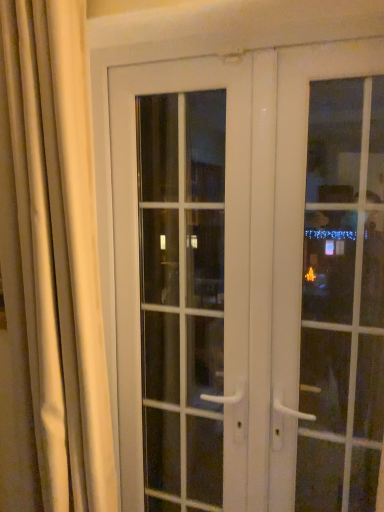
Question: In the image, is white glass door at center, acting as the first door starting from the left, positioned in front of or behind white glossy door at right, placed as the third door when sorted from left to right?

Choices:
 (A) behind
 (B) front

Answer: (A)

Question: Is white glass door at center, which is counted as the 3th door, starting from the right, taller or shorter than white glossy door at right, placed as the third door when sorted from left to right?

Choices:
 (A) tall
 (B) short

Answer: (A)

Question: Estimate the real-world distances between objects in this image. Which object is farther from the white glass door at center, which is counted as the 3th door, starting from the right?

Choices:
 (A) silky beige curtain at left
 (B) white glossy door at right, which is the first door in right-to-left order
 (C) white glossy door at center, the second door in the right-to-left sequence

Answer: (A)

Question: Which object is the closest to the white glossy door at right, which is the first door in right-to-left order?

Choices:
 (A) silky beige curtain at left
 (B) white glossy door at center, the second door in the right-to-left sequence
 (C) white glass door at center, which is counted as the 3th door, starting from the right

Answer: (B)